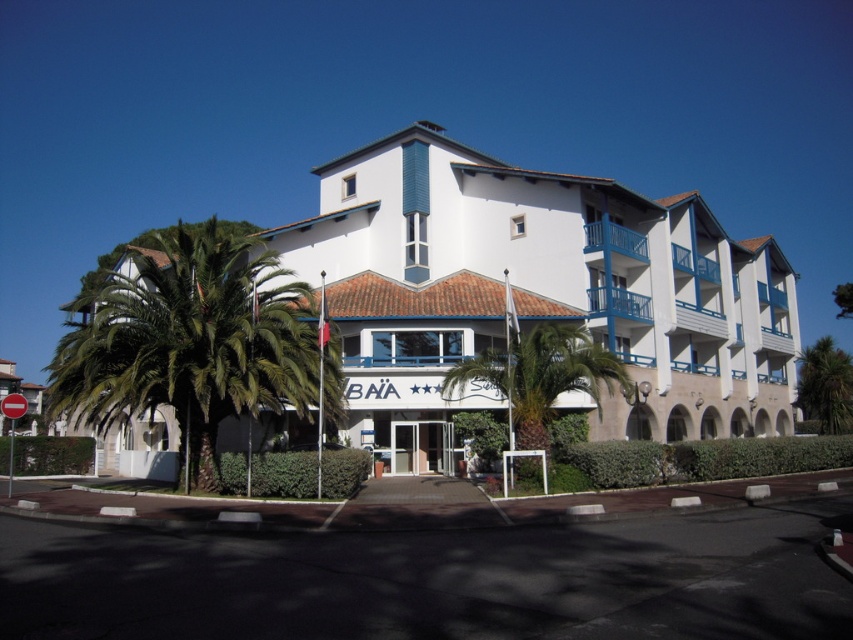
Is point (271, 257) less distant than point (468, 374)?

No, it is behind (468, 374).

Is green leafy palm tree at left thinner than green leafy palm tree at center?

Incorrect, green leafy palm tree at left's width is not less than green leafy palm tree at center's.

Who is more distant from viewer, (x=55, y=381) or (x=532, y=413)?

The point (x=532, y=413) is more distant.

At what (x,y) coordinates should I click in order to perform the action: click on green leafy palm tree at left. Please return your answer as a coordinate pair (x, y). Looking at the image, I should click on (189, 342).

Does green leafy palm tree at center appear on the left side of green leafy palm tree at right?

Indeed, green leafy palm tree at center is positioned on the left side of green leafy palm tree at right.

Can you confirm if green leafy palm tree at center is positioned above green leafy palm tree at right?

Result: Yes, green leafy palm tree at center is above green leafy palm tree at right.

This screenshot has height=640, width=853. In order to click on green leafy palm tree at center in this screenshot , I will do `click(540, 376)`.

Where is `green leafy palm tree at center`? green leafy palm tree at center is located at coordinates (540, 376).

How much distance is there between white matte building at center and green leafy palm tree at right?

white matte building at center is 13.69 meters from green leafy palm tree at right.

Between white matte building at center and green leafy palm tree at right, which one appears on the right side from the viewer's perspective?

From the viewer's perspective, green leafy palm tree at right appears more on the right side.

Is point (320, 268) less distant than point (805, 371)?

Yes, it is.

The height and width of the screenshot is (640, 853). Identify the location of white matte building at center. (538, 291).